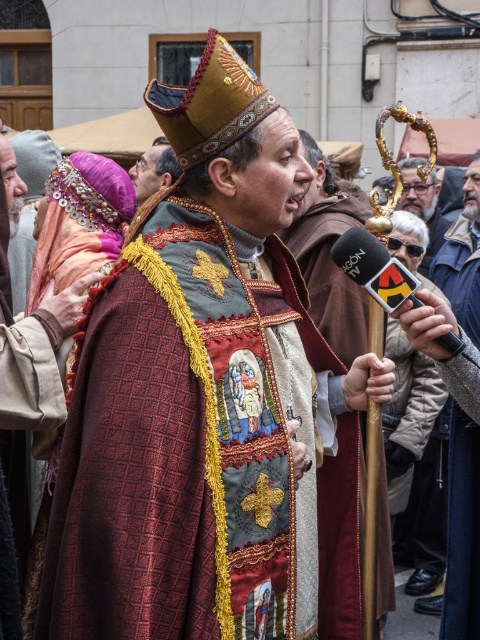
Question: Observing the image, what is the correct spatial positioning of black plastic microphone at center in reference to matte black microphone at center?

Choices:
 (A) below
 (B) above

Answer: (A)

Question: Can you confirm if black plastic microphone at center is positioned below matte black microphone at center?

Choices:
 (A) yes
 (B) no

Answer: (A)

Question: Which of these objects is positioned farthest from the black plastic microphone at center?

Choices:
 (A) velvet gold staff at center
 (B) matte black microphone at center
 (C) velvet brown robe at center

Answer: (B)

Question: Which object is closer to the camera taking this photo?

Choices:
 (A) matte black microphone at center
 (B) black plastic microphone at center
 (C) velvet brown robe at center
 (D) velvet gold staff at center

Answer: (B)

Question: Which of the following is the farthest from the observer?

Choices:
 (A) velvet gold staff at center
 (B) matte black microphone at center

Answer: (B)

Question: Considering the relative positions of velvet brown robe at center and velvet gold staff at center in the image provided, where is velvet brown robe at center located with respect to velvet gold staff at center?

Choices:
 (A) above
 (B) below

Answer: (A)